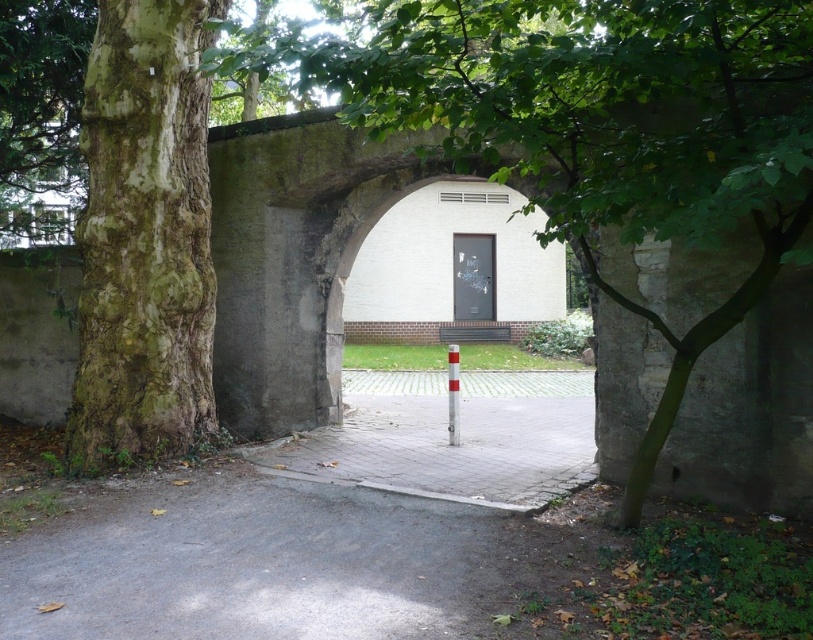
Question: Can you confirm if green leafy tree at center is bigger than paved stone alley at center?

Choices:
 (A) no
 (B) yes

Answer: (B)

Question: Based on their relative distances, which object is farther from the green leafy tree at center?

Choices:
 (A) white glossy pole at center
 (B) green mossy bark tree at left

Answer: (A)

Question: Which object appears closest to the camera in this image?

Choices:
 (A) green leafy tree at center
 (B) white glossy pole at center
 (C) green mossy bark tree at left
 (D) paved stone alley at center

Answer: (A)

Question: Is green mossy bark tree at left in front of white glossy pole at center?

Choices:
 (A) yes
 (B) no

Answer: (A)

Question: Is green mossy bark tree at left above paved stone alley at center?

Choices:
 (A) no
 (B) yes

Answer: (B)

Question: Which of the following is the farthest from the observer?

Choices:
 (A) paved stone alley at center
 (B) green mossy bark tree at left

Answer: (A)